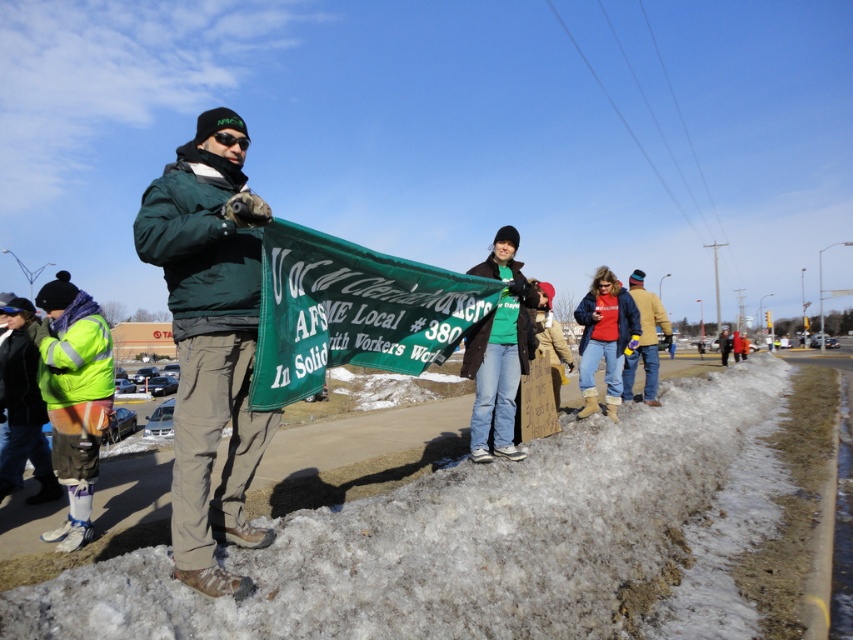
Question: Can you confirm if green matte shirt at center is smaller than red cotton shirt at center?

Choices:
 (A) no
 (B) yes

Answer: (A)

Question: Which point is closer to the camera taking this photo?

Choices:
 (A) (202, 380)
 (B) (621, 320)

Answer: (A)

Question: Estimate the real-world distances between objects in this image. Which object is farther from the red cotton shirt at center?

Choices:
 (A) high-visibility yellow jacket at lower left
 (B) reflective yellow safety vest at lower left
 (C) green fabric banner at center
 (D) blue jeans at center

Answer: (B)

Question: Considering the relative positions of green matte shirt at center and blue jeans at center in the image provided, where is green matte shirt at center located with respect to blue jeans at center?

Choices:
 (A) right
 (B) left

Answer: (B)

Question: Does high-visibility yellow jacket at lower left appear on the left side of red cotton jacket at center?

Choices:
 (A) yes
 (B) no

Answer: (A)

Question: Which of the following is the farthest from the observer?

Choices:
 (A) (643, 371)
 (B) (608, 298)

Answer: (A)